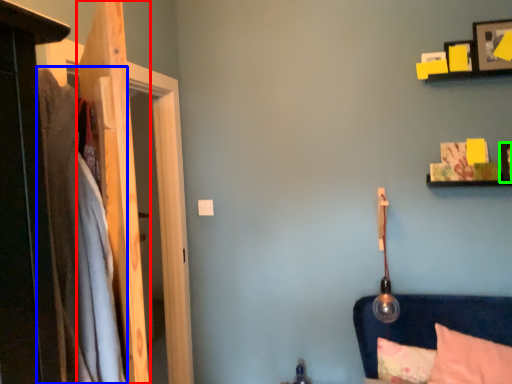
Question: Estimate the real-world distances between objects in this image. Which object is closer to door (highlighted by a red box), blanket (highlighted by a blue box) or picture frame (highlighted by a green box)?

Choices:
 (A) blanket
 (B) picture frame

Answer: (A)